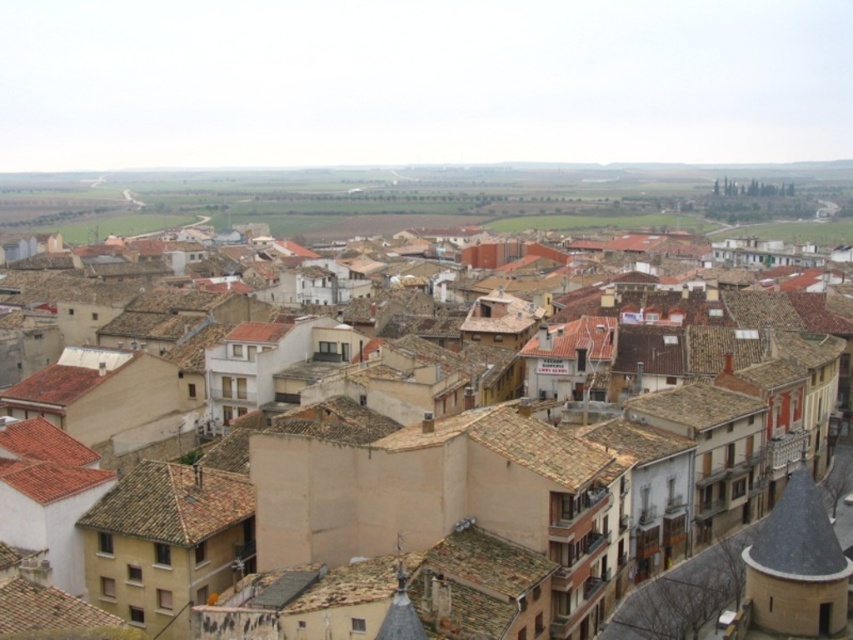
You are a delivery drone that needs to fly over the urban area in the image. You must pass between the brown tile roof at center and the brown tile roof at lower left. Can you safely navigate this path if your drone has a minimum required clearance of 2 meters?

The brown tile roof at center has a greater height compared to brown tile roof at lower left. To determine safe passage, the drone must ensure clearance based on the taller roof, which is the brown tile roof at center. However, without specific height measurements, it is impossible to confirm if the 2 meters clearance is sufficient. More information about the actual heights is needed.

You are standing in the urban area looking at the two brown tile roofs. Which one appears nearer to you, the brown tile roof at center or the brown tile roof at lower left?

The brown tile roof at center is closer to the viewer than the brown tile roof at lower left, so it appears nearer.